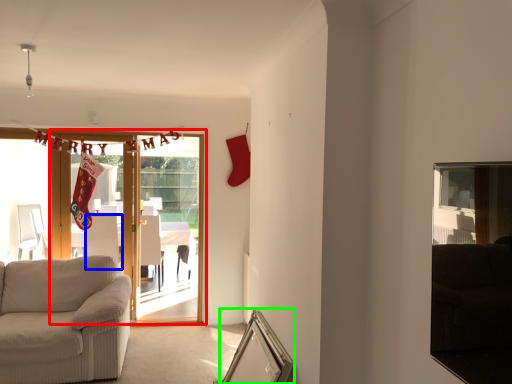
Question: Which is nearer to the door (highlighted by a red box)? armchair (highlighted by a blue box) or picture frame (highlighted by a green box).

Choices:
 (A) armchair
 (B) picture frame

Answer: (B)